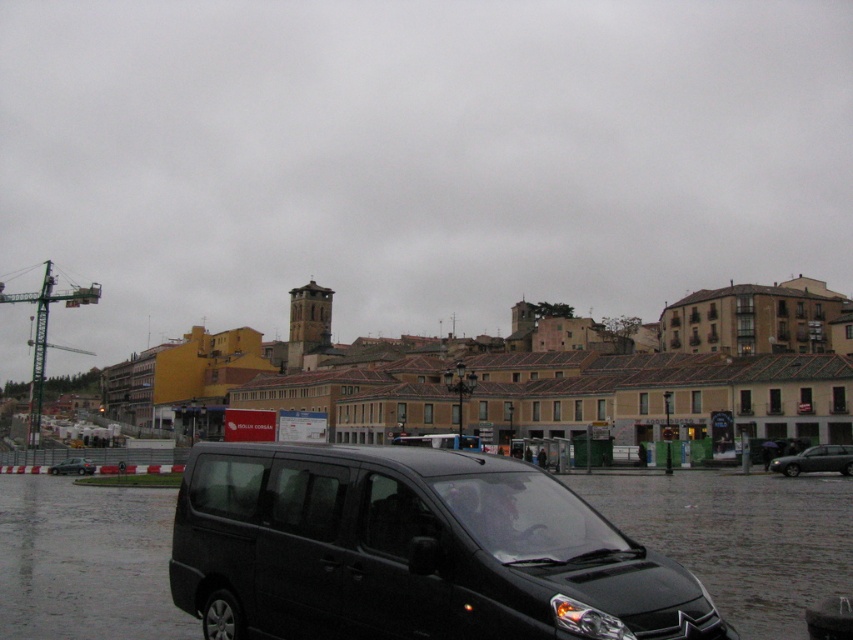
Question: Is green metallic crane at left below metallic silver hatchback at lower left?

Choices:
 (A) yes
 (B) no

Answer: (B)

Question: Which of these objects is positioned closest to the dark gray metallic car at right?

Choices:
 (A) black matte van at lower left
 (B) black matte van at center
 (C) metallic silver hatchback at lower left
 (D) green metallic crane at left

Answer: (A)

Question: Is black matte van at lower left to the left of green metallic crane at left from the viewer's perspective?

Choices:
 (A) yes
 (B) no

Answer: (B)

Question: Is black matte van at lower left wider than green metallic crane at left?

Choices:
 (A) no
 (B) yes

Answer: (A)

Question: Which of the following is the farthest from the observer?

Choices:
 (A) black matte van at lower left
 (B) dark gray metallic car at right
 (C) black matte van at center

Answer: (C)

Question: Which is nearer to the dark gray metallic car at right?

Choices:
 (A) black matte van at lower left
 (B) metallic silver hatchback at lower left
 (C) black matte van at center
 (D) green metallic crane at left

Answer: (A)